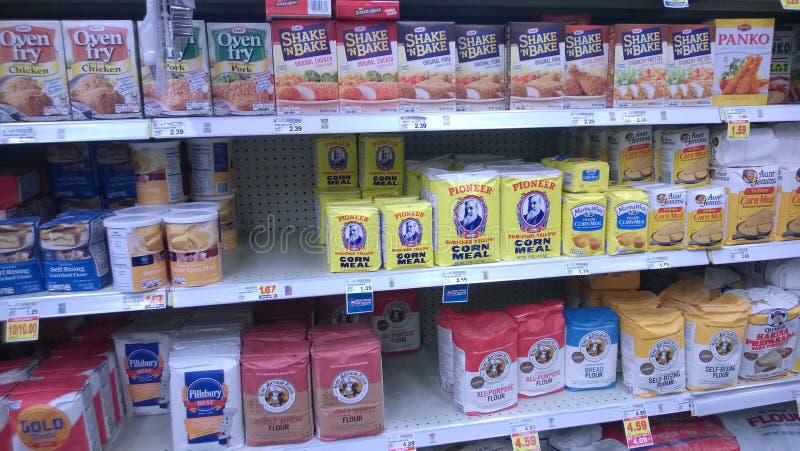
The width and height of the screenshot is (800, 451). Identify the location of box. (350, 238).